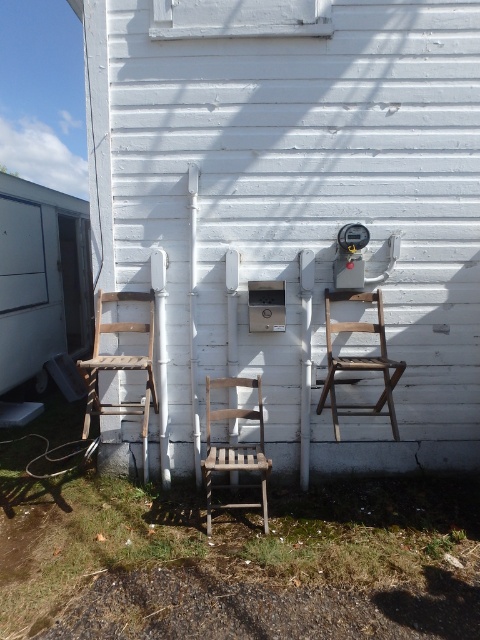
Question: Which object is positioned farthest from the wooden chair at left?

Choices:
 (A) wooden chair at center
 (B) wooden slatted chair at center

Answer: (A)

Question: Can you confirm if wooden chair at center is positioned above wooden chair at left?

Choices:
 (A) yes
 (B) no

Answer: (A)

Question: Is wooden chair at center below wooden chair at left?

Choices:
 (A) no
 (B) yes

Answer: (A)

Question: Based on their relative distances, which object is nearer to the wooden chair at center?

Choices:
 (A) wooden slatted chair at center
 (B) wooden chair at left

Answer: (A)

Question: Does wooden chair at center appear over wooden slatted chair at center?

Choices:
 (A) no
 (B) yes

Answer: (B)

Question: Among these points, which one is farthest from the camera?

Choices:
 (A) (262, 474)
 (B) (145, 385)
 (C) (380, 410)

Answer: (B)